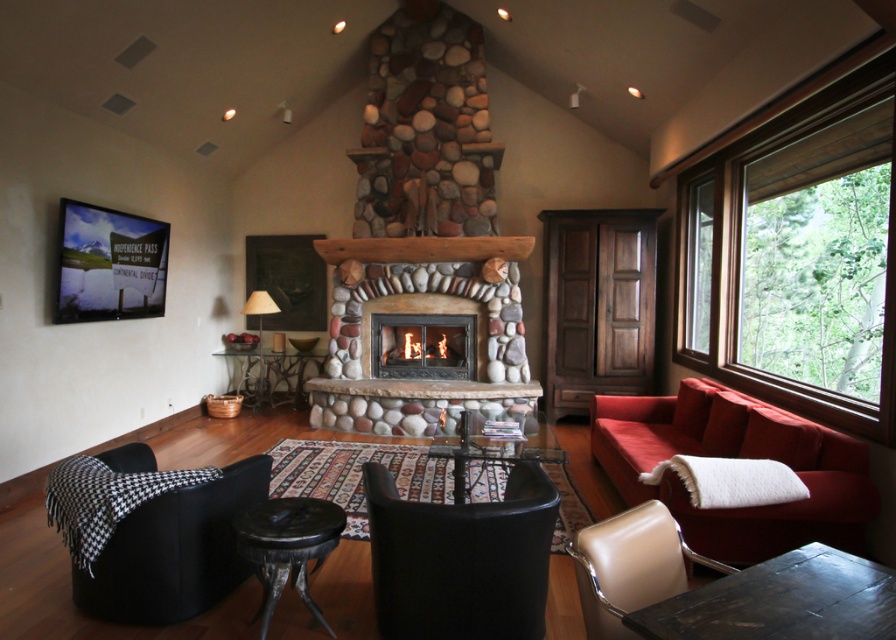
Question: Is black leather armchair at left behind beige leather armchair at lower right?

Choices:
 (A) no
 (B) yes

Answer: (B)

Question: Which point is farther to the camera?

Choices:
 (A) dark brown wooden stool at lower center
 (B) black leather armchair at left
 (C) beige leather armchair at lower right
 (D) rustic stone fireplace at center

Answer: (D)

Question: Considering the real-world distances, which object is closest to the wooden frame at right?

Choices:
 (A) black leather armchair at left
 (B) dark brown wooden stool at lower center
 (C) black leather armchair at center
 (D) beige leather armchair at lower right

Answer: (C)

Question: Where is velvet red couch at right located in relation to rustic stone fireplace at center in the image?

Choices:
 (A) below
 (B) above

Answer: (A)

Question: Is black leather armchair at left thinner than dark brown wooden stool at lower center?

Choices:
 (A) no
 (B) yes

Answer: (A)

Question: Which of the following is the farthest from the observer?

Choices:
 (A) natural stone fireplace at center
 (B) velvet red couch at right
 (C) dark brown wooden stool at lower center

Answer: (A)